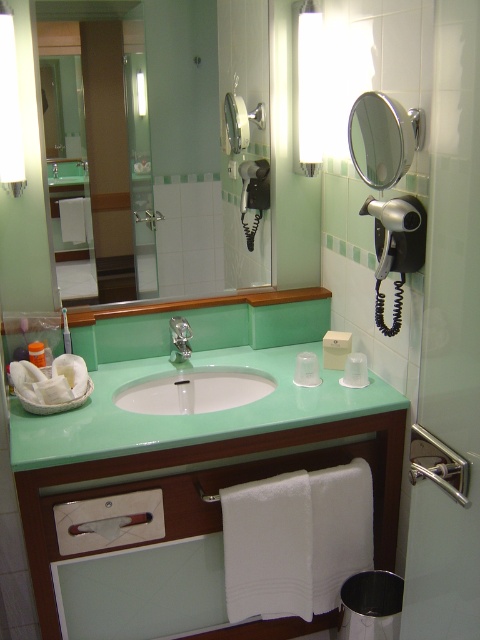
Who is more distant from viewer, (357, 163) or (173, 349)?

The point (173, 349) is more distant.

Between metallic circular mirror at upper right and satin nickel faucet at sink center, which one appears on the left side from the viewer's perspective?

satin nickel faucet at sink center is more to the left.

Identify the location of metallic circular mirror at upper right. (383, 138).

The width and height of the screenshot is (480, 640). I want to click on metallic circular mirror at upper right, so click(x=383, y=138).

Who is taller, satin nickel faucet at sink center or white matte toothbrush at left?

satin nickel faucet at sink center

Does satin nickel faucet at sink center have a smaller size compared to white matte toothbrush at left?

Incorrect, satin nickel faucet at sink center is not smaller in size than white matte toothbrush at left.

Who is more distant from viewer, (169, 320) or (40, 365)?

Point (169, 320)

This screenshot has height=640, width=480. I want to click on satin nickel faucet at sink center, so click(x=180, y=339).

This screenshot has width=480, height=640. What do you see at coordinates (339, 529) in the screenshot? I see `white fabric hand towel at lower center` at bounding box center [339, 529].

Who is shorter, white fabric hand towel at lower center or clear plastic cup at center?

clear plastic cup at center is shorter.

What do you see at coordinates (339, 529) in the screenshot? I see `white fabric hand towel at lower center` at bounding box center [339, 529].

Identify the location of white fabric hand towel at lower center. (339, 529).